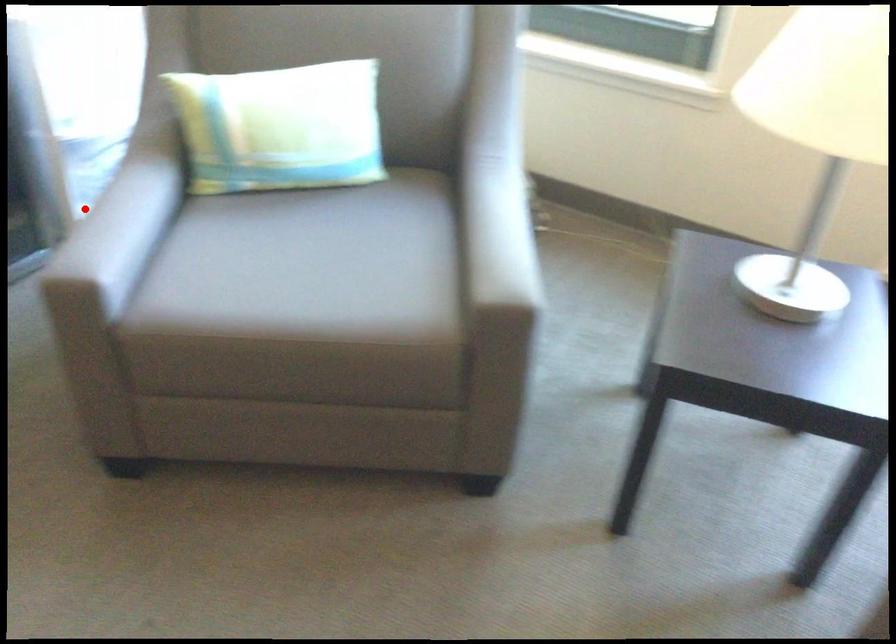
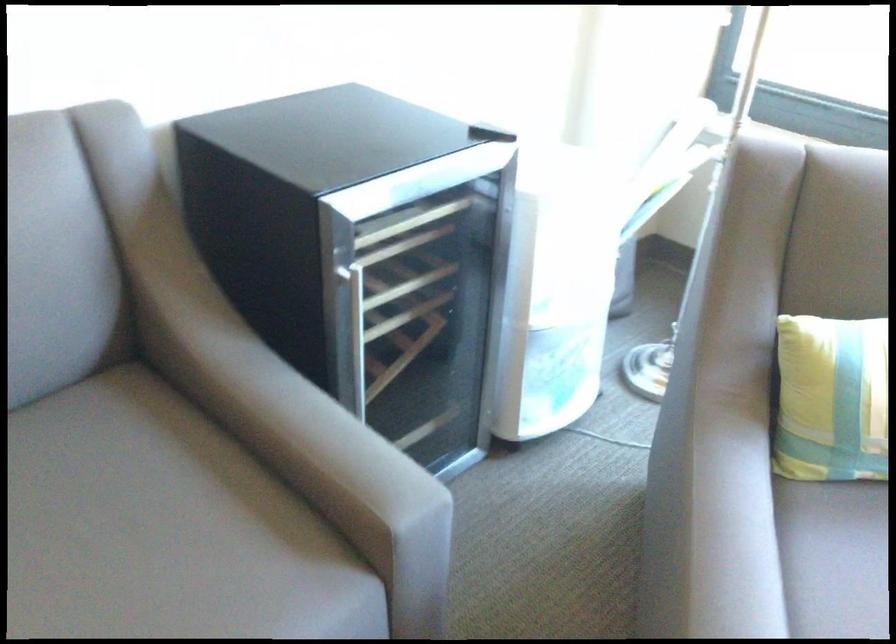
Question: I am providing you with two images of the same scene from different viewpoints. Image1 has a red point marked. In image2, the corresponding 3D location appears at what relative position? Reply with the corresponding letter.

Choices:
 (A) Closer
 (B) Farther

Answer: (A)